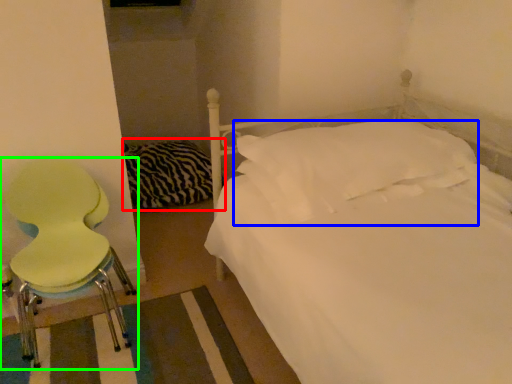
Question: Which object is the farthest from bedding (highlighted by a red box)? Choose among these: pillow (highlighted by a blue box) or chair (highlighted by a green box).

Choices:
 (A) pillow
 (B) chair

Answer: (A)